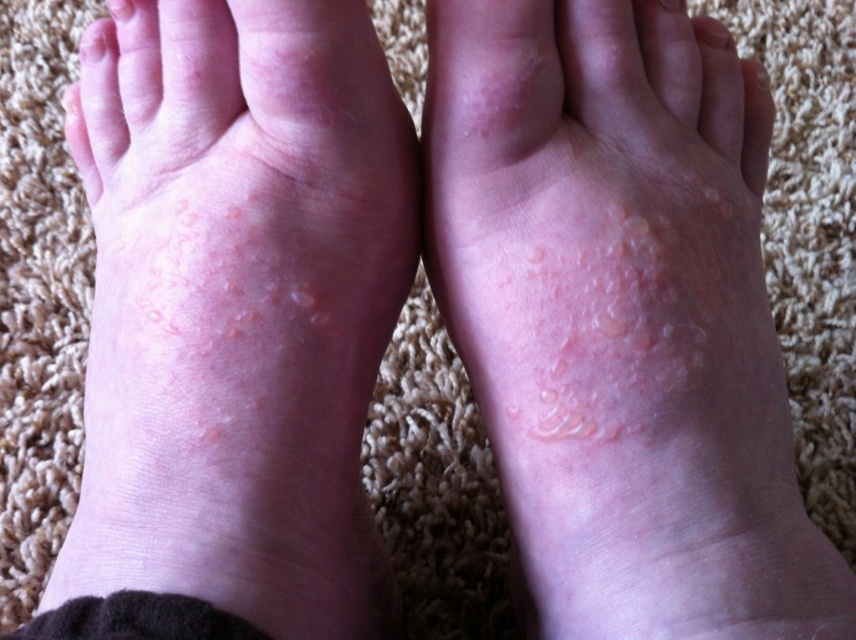
The width and height of the screenshot is (856, 640). In order to click on dry skin patches at lower left in this screenshot , I will do (238, 307).

Is point (248, 292) less distant than point (718, 22)?

Yes, it is.

This screenshot has height=640, width=856. What do you see at coordinates (238, 307) in the screenshot? I see `dry skin patches at lower left` at bounding box center [238, 307].

Identify the location of dry skin patches at lower left. The image size is (856, 640). (238, 307).

Consider the image. Can you confirm if smooth skin at lower center is positioned below dry skin at upper left?

Yes, smooth skin at lower center is below dry skin at upper left.

Which of these two, smooth skin at lower center or dry skin at upper left, stands shorter?

Standing shorter between the two is dry skin at upper left.

What do you see at coordinates (135, 620) in the screenshot? Image resolution: width=856 pixels, height=640 pixels. I see `smooth skin at lower center` at bounding box center [135, 620].

Locate an element on the screen. The image size is (856, 640). smooth skin at lower center is located at coordinates (135, 620).

Can you confirm if smooth skin at upper center is positioned below dry skin at upper left?

Yes, smooth skin at upper center is below dry skin at upper left.

Between point (712, 44) and point (117, 20), which one is positioned behind?

The point (712, 44) is more distant.

The width and height of the screenshot is (856, 640). Describe the element at coordinates (712, 33) in the screenshot. I see `smooth skin at upper center` at that location.

Image resolution: width=856 pixels, height=640 pixels. I want to click on smooth skin at upper center, so click(712, 33).